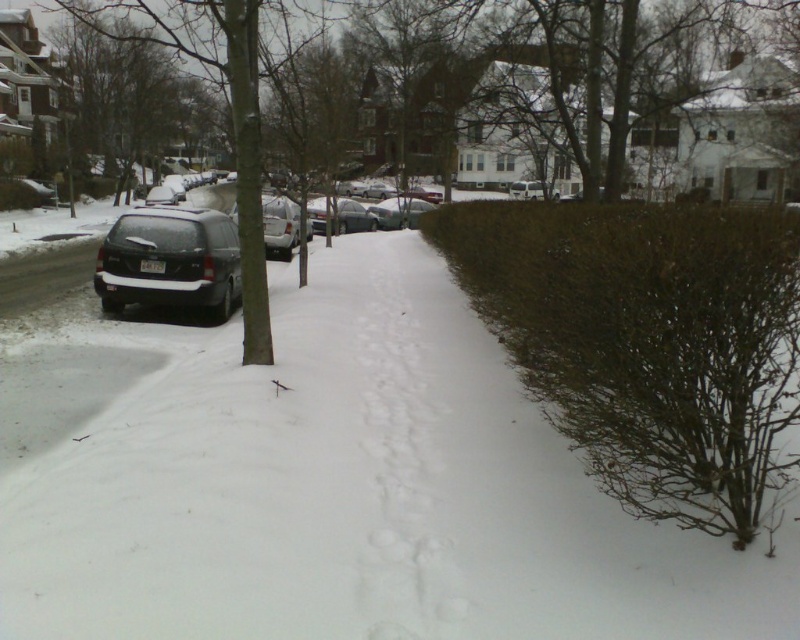
Question: Which point is farther to the camera?

Choices:
 (A) (206, 252)
 (B) (400, 212)
 (C) (350, 218)

Answer: (B)

Question: Can you confirm if satin silver sedan at center is positioned below sleek silver sedan at center?

Choices:
 (A) no
 (B) yes

Answer: (B)

Question: Does snowy asphalt sidewalk at center have a larger size compared to sleek silver sedan at center?

Choices:
 (A) no
 (B) yes

Answer: (A)

Question: In this image, where is brown textured hedge at right located relative to green textured tree at left?

Choices:
 (A) right
 (B) left

Answer: (A)

Question: Which point is closer to the camera?

Choices:
 (A) (188, 38)
 (B) (340, 227)
 (C) (560, 272)

Answer: (C)

Question: Which point appears closest to the camera in this image?

Choices:
 (A) (164, 12)
 (B) (360, 371)
 (C) (354, 228)

Answer: (B)